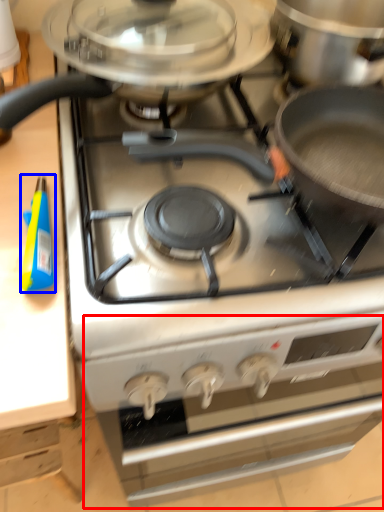
Question: Which object appears closest to the camera in this image, oven (highlighted by a red box) or appliance (highlighted by a blue box)?

Choices:
 (A) oven
 (B) appliance

Answer: (B)